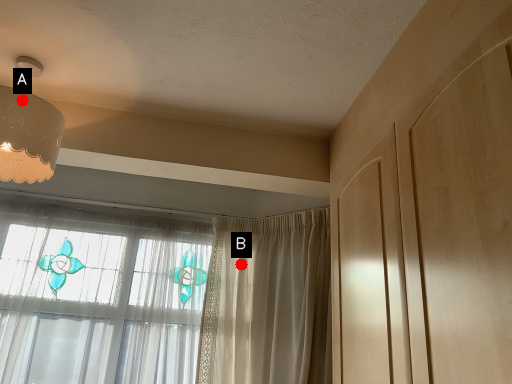
Question: Two points are circled on the image, labeled by A and B beside each circle. Which of the following is the farthest from the observer?

Choices:
 (A) A is further
 (B) B is further

Answer: (B)